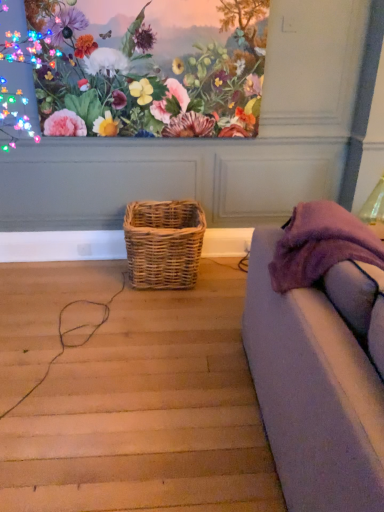
Question: Is purple fabric couch at right taller than woven natural basket at center?

Choices:
 (A) yes
 (B) no

Answer: (A)

Question: Does purple fabric couch at right have a larger size compared to woven natural basket at center?

Choices:
 (A) no
 (B) yes

Answer: (B)

Question: Would you say woven natural basket at center is part of purple fabric couch at right's contents?

Choices:
 (A) no
 (B) yes

Answer: (A)

Question: Is purple fabric couch at right facing away from woven natural basket at center?

Choices:
 (A) yes
 (B) no

Answer: (B)

Question: From a real-world perspective, is purple fabric couch at right located higher than woven natural basket at center?

Choices:
 (A) yes
 (B) no

Answer: (A)

Question: Is purple fabric couch at right far from woven natural basket at center?

Choices:
 (A) yes
 (B) no

Answer: (A)

Question: Does matte floral painting at upper center have a greater width compared to woven natural basket at center?

Choices:
 (A) no
 (B) yes

Answer: (A)

Question: Does matte floral painting at upper center come in front of woven natural basket at center?

Choices:
 (A) no
 (B) yes

Answer: (B)

Question: Is the depth of matte floral painting at upper center greater than that of woven natural basket at center?

Choices:
 (A) no
 (B) yes

Answer: (A)

Question: Does matte floral painting at upper center have a lesser height compared to woven natural basket at center?

Choices:
 (A) yes
 (B) no

Answer: (B)

Question: Considering the relative positions of matte floral painting at upper center and woven natural basket at center in the image provided, is matte floral painting at upper center to the left of woven natural basket at center from the viewer's perspective?

Choices:
 (A) yes
 (B) no

Answer: (A)

Question: Considering the relative positions of matte floral painting at upper center and woven natural basket at center in the image provided, is matte floral painting at upper center to the right of woven natural basket at center from the viewer's perspective?

Choices:
 (A) no
 (B) yes

Answer: (A)

Question: Can you confirm if purple fabric couch at right is shorter than matte floral painting at upper center?

Choices:
 (A) yes
 (B) no

Answer: (B)